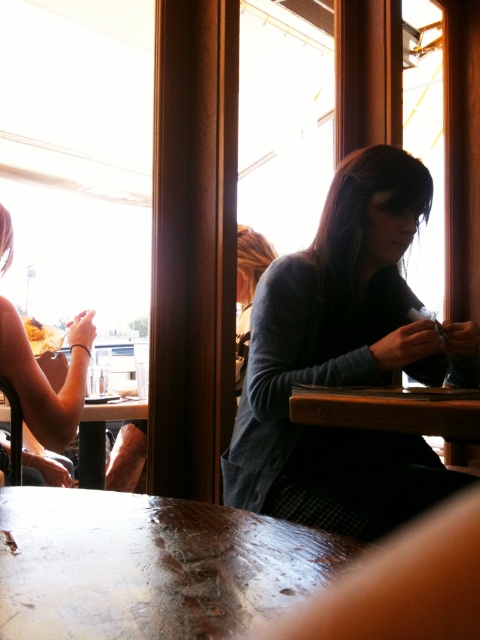
You are a waiter carrying a tray of dishes. You need to walk from the matte black shirt at left to the wooden table at center. How much space do you have to maneuver between them?

The distance between the matte black shirt at left and the wooden table at center is 73.35 centimeters, which should provide sufficient space for a waiter to maneuver with a tray of dishes.

You are a customer in this cafe and you want to place your phone on the table. The gray sweater at center and the matte yellow food at lower left are already on the table. Which object should you move to make space, considering their sizes?

The gray sweater at center has a larger size compared to matte yellow food at lower left. Therefore, moving the matte yellow food at lower left would require less space adjustment since it is smaller.

You are standing at the entrance of the cafe and want to sit at the wooden table at center. According to the coordinates provided, in which direction should you walk to reach it?

The wooden table at center is located at coordinates point (393,410), which suggests it is positioned towards the lower right of the image. You should walk towards the lower right direction to reach it.